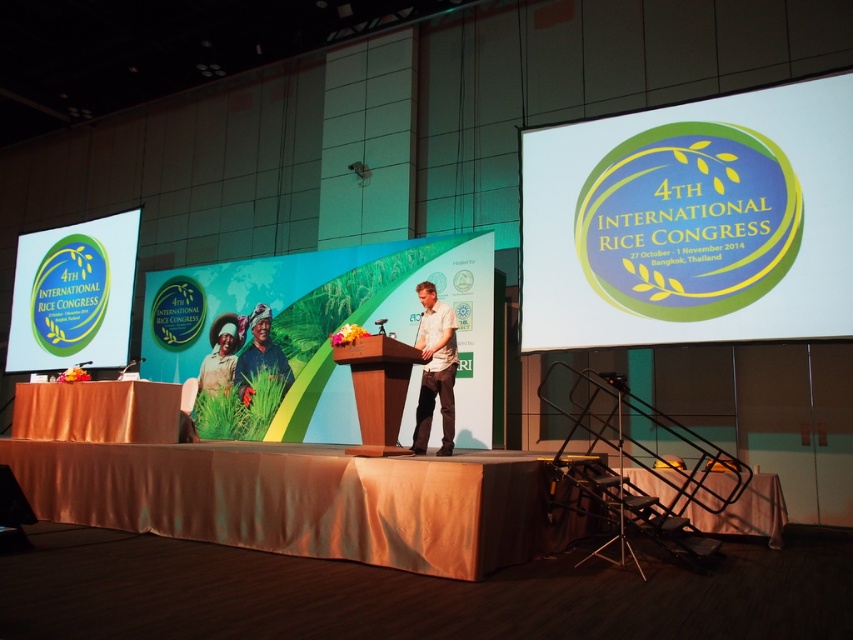
Can you confirm if orange fabric table at center is wider than wooden podium at center?

Indeed, orange fabric table at center has a greater width compared to wooden podium at center.

Can you confirm if orange fabric table at center is positioned below wooden podium at center?

Yes, orange fabric table at center is below wooden podium at center.

Does point (404, 515) lie behind point (364, 353)?

No, (404, 515) is closer to viewer.

You are a GUI agent. You are given a task and a screenshot of the screen. Output one action in this format:
    pyautogui.click(x=<x>, y=<y>)
    Task: Click on the orange fabric table at center
    This screenshot has height=640, width=853.
    Given the screenshot: What is the action you would take?
    pyautogui.click(x=305, y=500)

From the picture: Measure the distance between orange fabric table at lower left and matte black shirt at center.

orange fabric table at lower left is 7.04 feet from matte black shirt at center.

Is orange fabric table at lower left positioned at the back of matte black shirt at center?

No, it is not.

Where is `orange fabric table at lower left`? The height and width of the screenshot is (640, 853). orange fabric table at lower left is located at coordinates (97, 412).

Who is more forward, (42, 460) or (155, 429)?

Point (155, 429) is more forward.

Which of these two, orange fabric table at center or orange fabric table at lower left, stands shorter?

orange fabric table at lower left

Find the location of a particular element. orange fabric table at center is located at coordinates (305, 500).

Where is `orange fabric table at center`? This screenshot has height=640, width=853. orange fabric table at center is located at coordinates (305, 500).